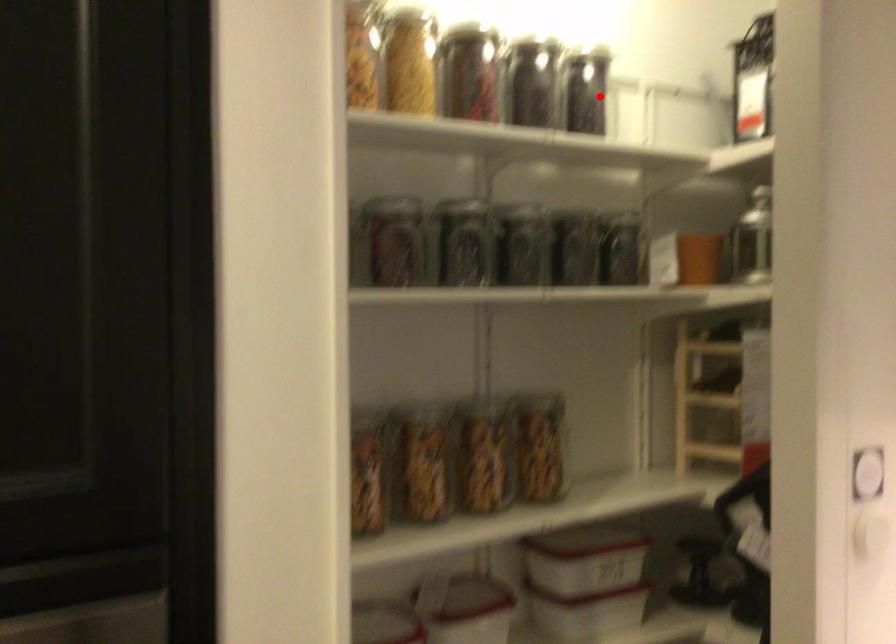
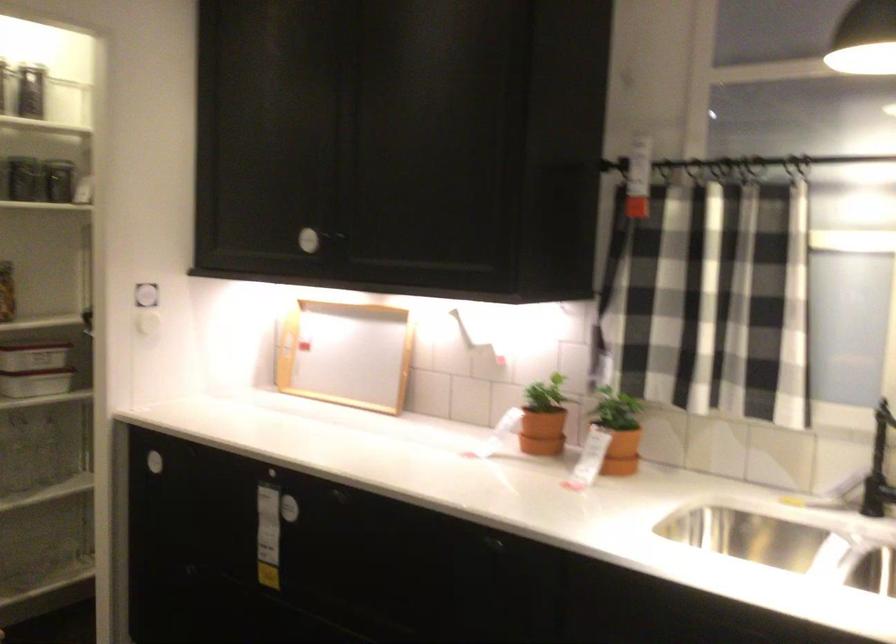
Locate, in the second image, the point that corresponds to the highlighted location in the first image.

(39, 91)